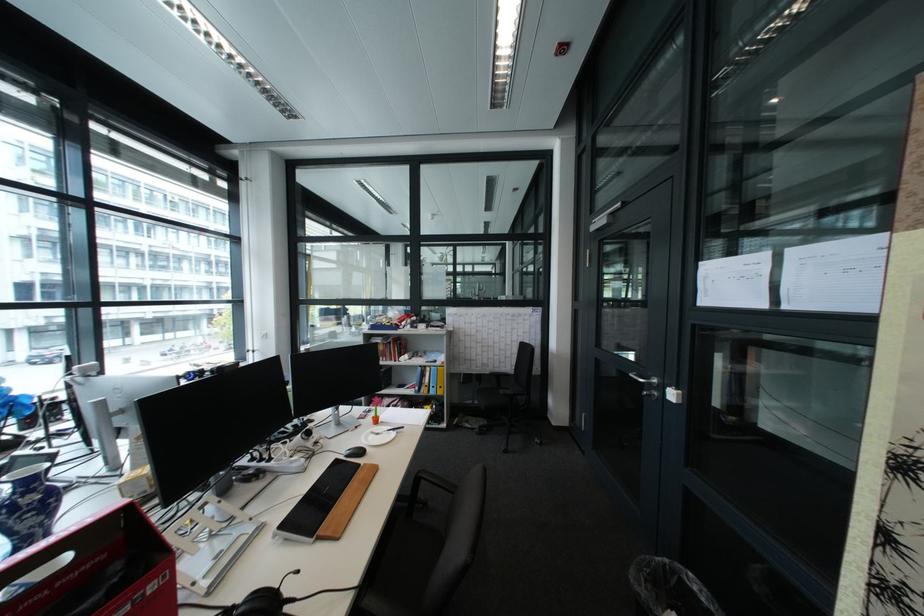
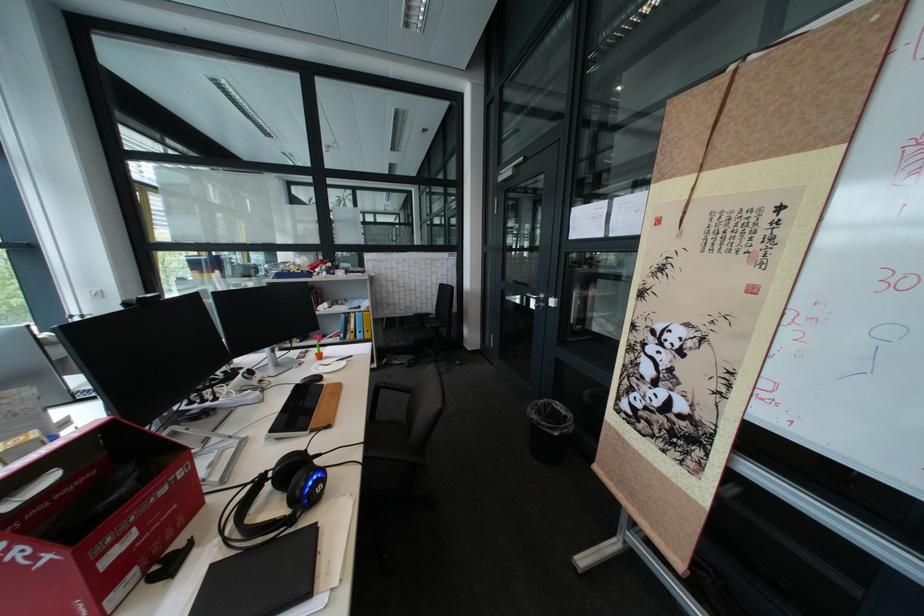
The point at (442,370) is marked in the first image. Where is the corresponding point in the second image?

(367, 315)